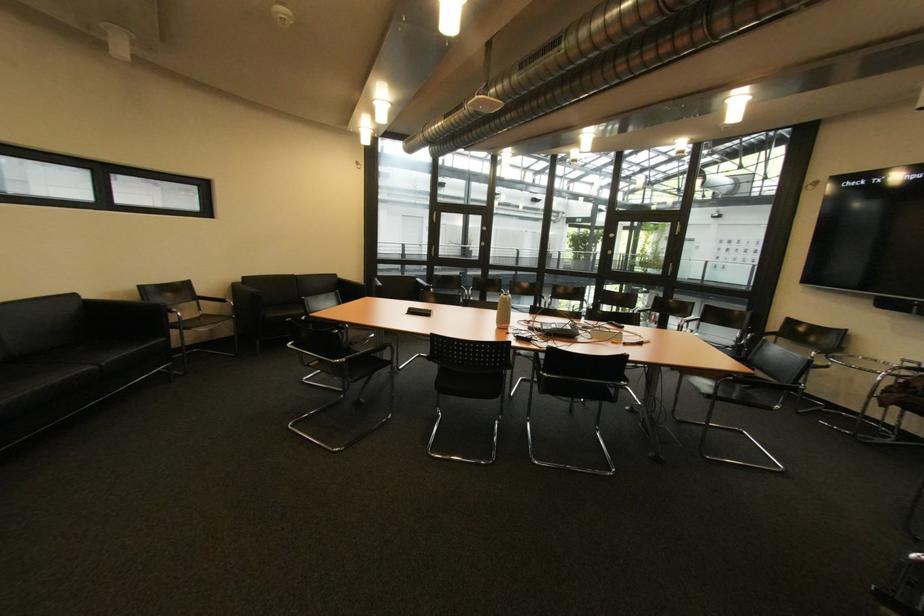
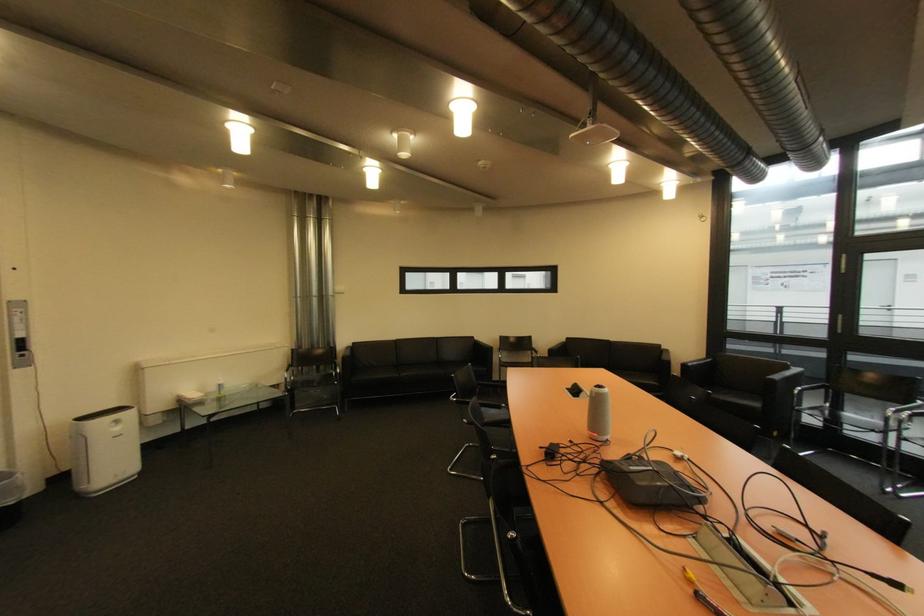
Where in the second image is the point corresponding to the point at 415,314 from the first image?

(578, 389)